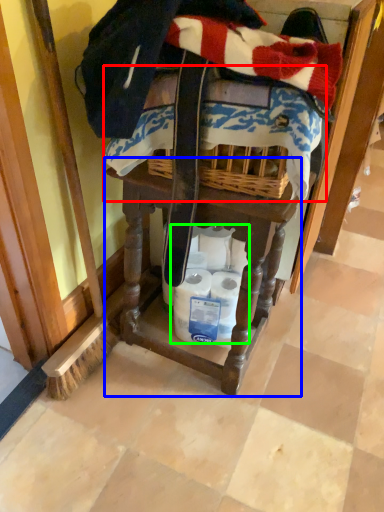
Question: Based on their relative distances, which object is nearer to underclothes (highlighted by a red box)? Choose from vanity (highlighted by a blue box) and toilet paper (highlighted by a green box).

Choices:
 (A) vanity
 (B) toilet paper

Answer: (A)